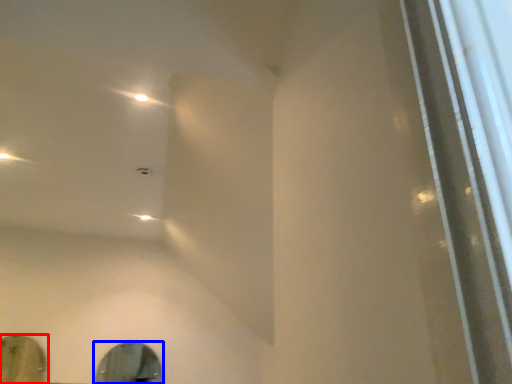
Question: Among these objects, which one is nearest to the camera, mirror (highlighted by a red box) or mirror (highlighted by a blue box)?

Choices:
 (A) mirror
 (B) mirror

Answer: (A)